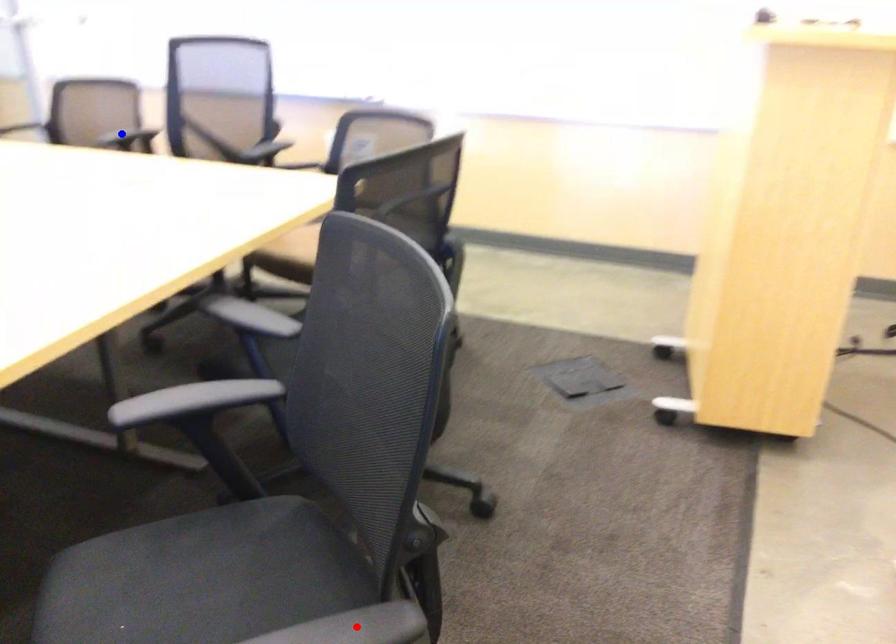
Question: In the image, two points are highlighted. Which point is nearer to the camera? Reply with the corresponding letter.

Choices:
 (A) blue point
 (B) red point

Answer: (B)